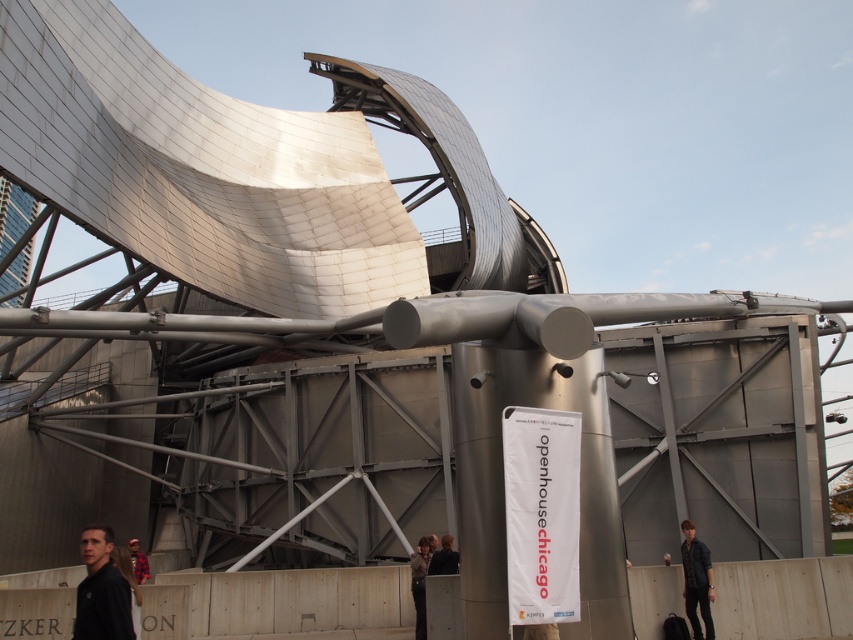
Question: Which point is farther to the camera?

Choices:
 (A) denim jacket at lower right
 (B) dark gray hoodie at lower left
 (C) dark brown hair at center

Answer: (C)

Question: Is denim jacket at lower right above dark brown hair at center?

Choices:
 (A) yes
 (B) no

Answer: (A)

Question: Is dark gray hoodie at lower left closer to camera compared to denim jacket at lower right?

Choices:
 (A) yes
 (B) no

Answer: (A)

Question: Does dark gray hoodie at lower left appear on the left side of red plaid shirt at lower left?

Choices:
 (A) yes
 (B) no

Answer: (B)

Question: Among these points, which one is farthest from the camera?

Choices:
 (A) (97, 596)
 (B) (445, 557)

Answer: (B)

Question: Which of these objects is positioned farthest from the dark gray hoodie at lower left?

Choices:
 (A) dark gray fabric jacket at lower center
 (B) red plaid shirt at lower left
 (C) dark brown hair at center
 (D) denim jacket at lower right

Answer: (D)